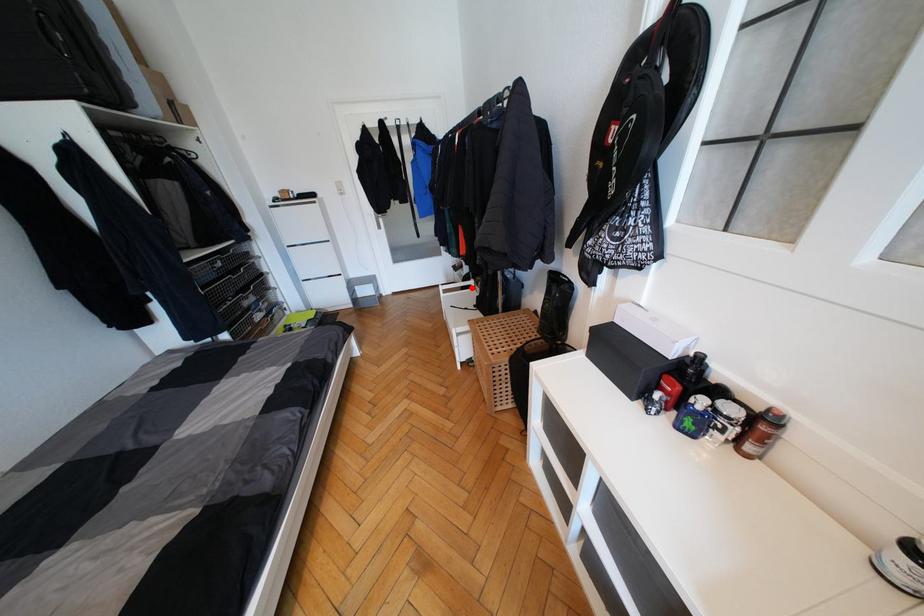
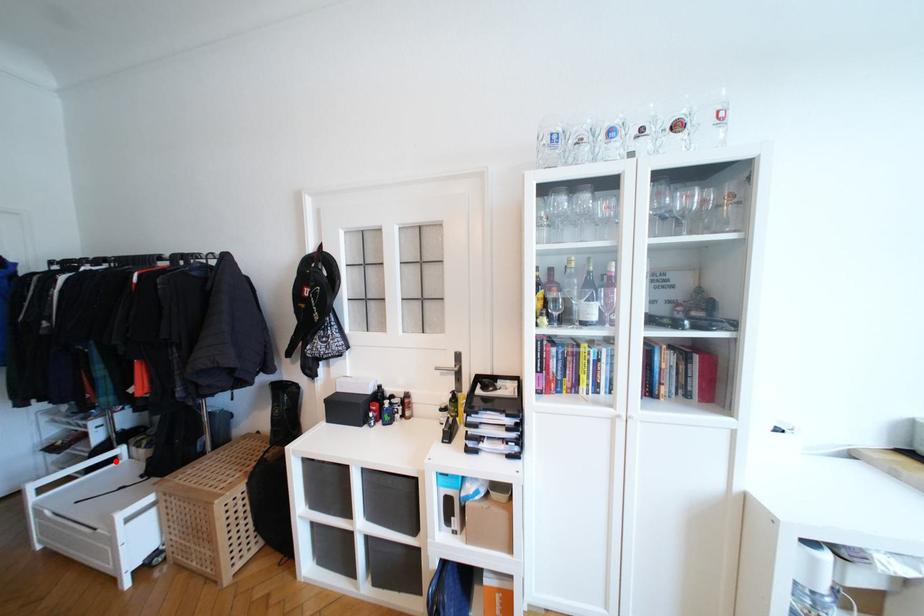
I am providing you with two images of the same scene from different viewpoints. A red point is marked on the first image and another point is marked on the second image. Do the highlighted points in image1 and image2 indicate the same real-world spot?

Yes